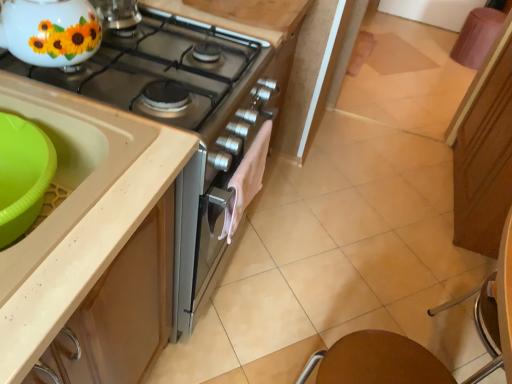
The image size is (512, 384). What are the coordinates of `free space to the left of pink fabric bar stool at upper right` in the screenshot? It's located at (434, 51).